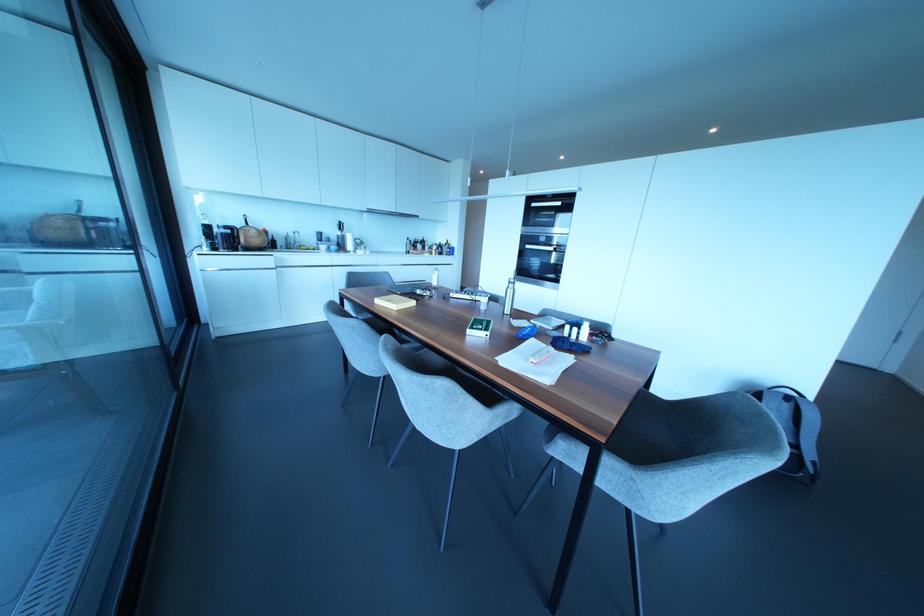
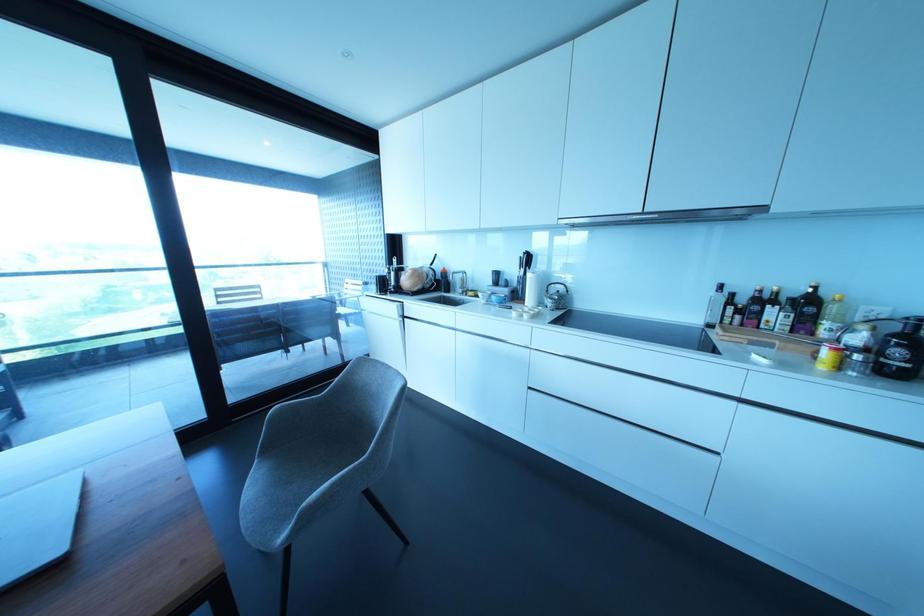
The point at (341, 225) is marked in the first image. Where is the corresponding point in the second image?

(527, 259)